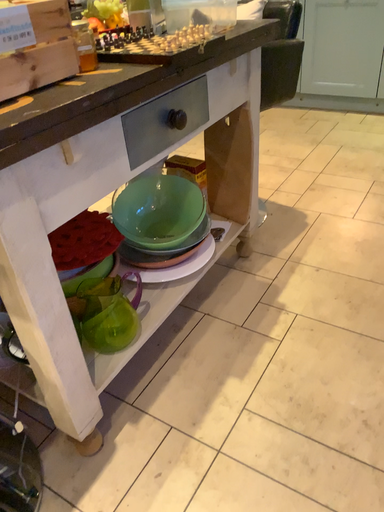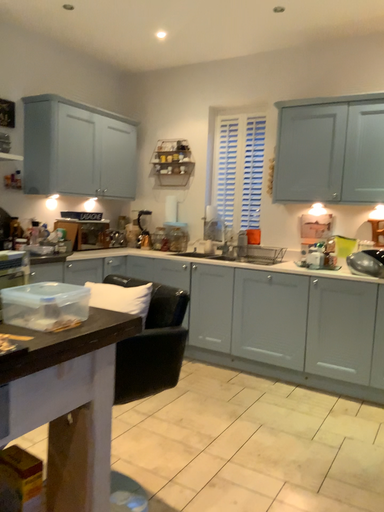
Question: Which way did the camera rotate in the video?

Choices:
 (A) rotated upward
 (B) rotated downward

Answer: (A)